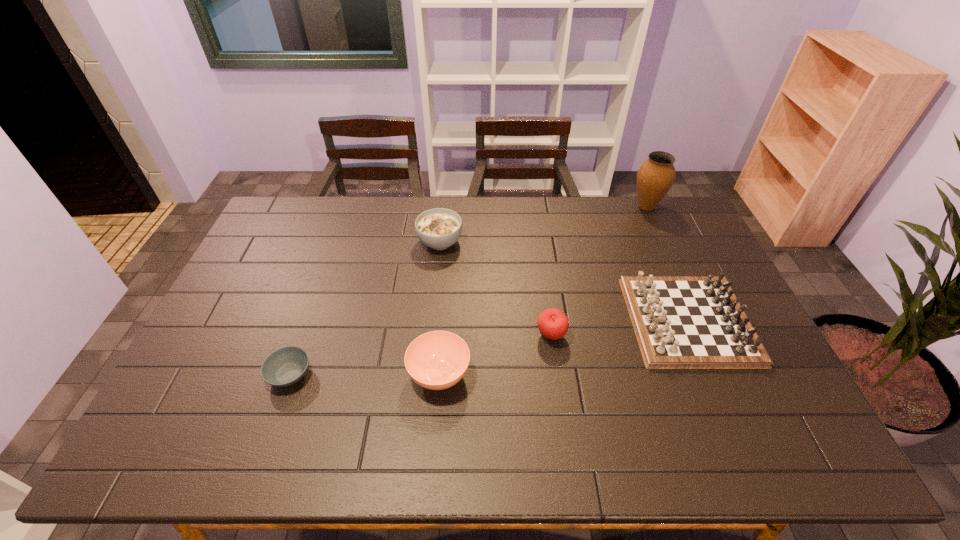
I want to click on blank area located 0.350m on the left of the farthest soup bowl, so click(x=317, y=242).

This screenshot has height=540, width=960. Identify the location of free space located 0.390m on the left of the apple. (398, 335).

Where is `vacant region located from the player's perspective of the chessboard`? vacant region located from the player's perspective of the chessboard is located at coordinates (589, 320).

Locate an element on the screen. The image size is (960, 540). vacant space located from the player's perspective of the chessboard is located at coordinates (607, 320).

Locate an element on the screen. free spot located 0.170m from the player's perspective of the chessboard is located at coordinates (573, 320).

The width and height of the screenshot is (960, 540). I want to click on vacant space located 0.170m on the right of the second tallest soup bowl, so click(535, 374).

The height and width of the screenshot is (540, 960). I want to click on vacant space located on the right of the leftmost soup bowl, so click(x=461, y=374).

Locate an element on the screen. urn that is positioned at the far edge is located at coordinates (656, 175).

Locate an element on the screen. The height and width of the screenshot is (540, 960). soup bowl that is at the far edge is located at coordinates (439, 228).

Where is `urn that is at the right edge`? urn that is at the right edge is located at coordinates (656, 175).